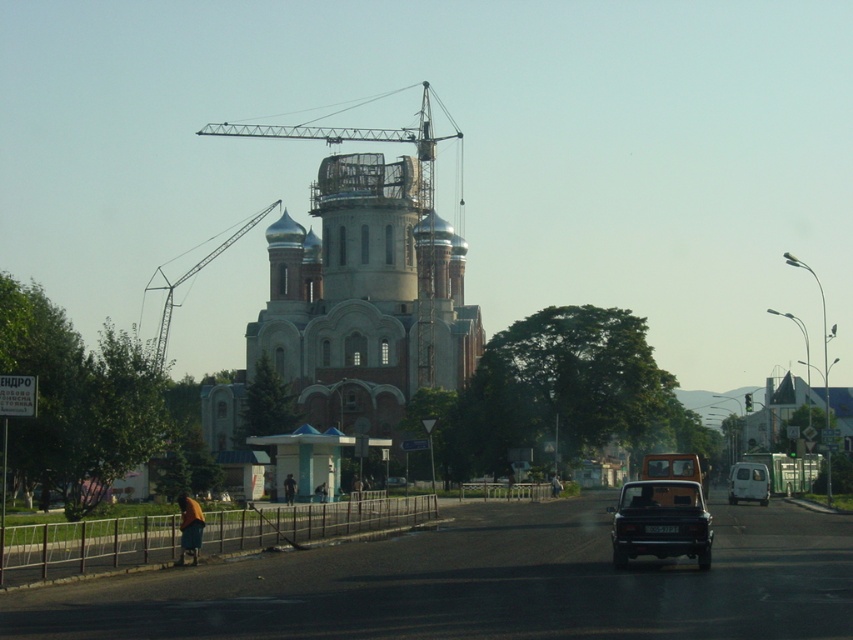
Between point (444, 317) and point (405, 477), which one is positioned in front?

Point (405, 477)

Find the location of `light gray stone church at center`. light gray stone church at center is located at coordinates (364, 284).

What do you see at coordinates (364, 284) in the screenshot? I see `light gray stone church at center` at bounding box center [364, 284].

Locate an element on the screen. light gray stone church at center is located at coordinates (364, 284).

Between metallic construction crane at center and brown matte car at center, which one is positioned lower?

brown matte car at center is below.

This screenshot has height=640, width=853. Find the location of `metallic construction crane at center`. metallic construction crane at center is located at coordinates (189, 276).

This screenshot has height=640, width=853. What are the coordinates of `metallic construction crane at center` in the screenshot? It's located at (189, 276).

Identify the location of metallic construction crane at center. The width and height of the screenshot is (853, 640). (189, 276).

Based on the photo, which of these two, shiny black sedan at center or matte black car at center, stands taller?

With more height is shiny black sedan at center.

Where is `shiny black sedan at center`? The width and height of the screenshot is (853, 640). shiny black sedan at center is located at coordinates (660, 522).